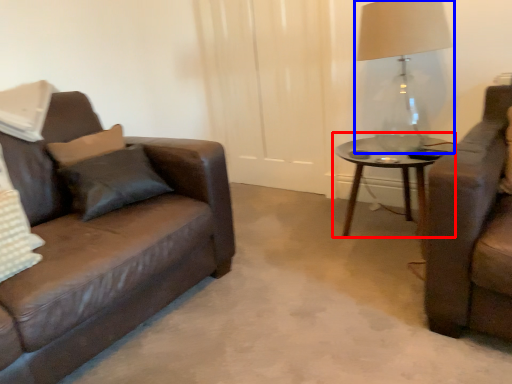
Question: Which object appears farthest to the camera in this image, coffee table (highlighted by a red box) or table lamp (highlighted by a blue box)?

Choices:
 (A) coffee table
 (B) table lamp

Answer: (A)